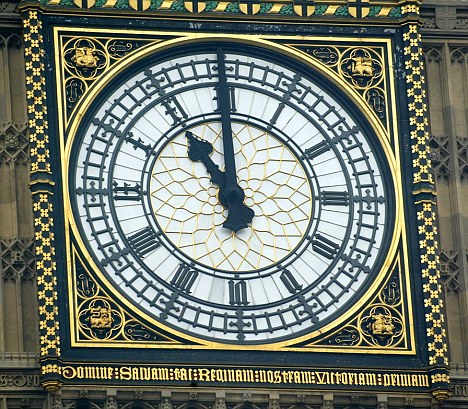
Locate an element on the screen. The width and height of the screenshot is (468, 409). flowery gold centre of clock is located at coordinates (187, 200).